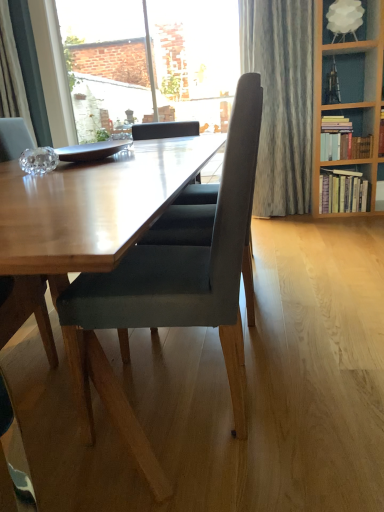
Question: In the image, is wooden table at center on the left side or the right side of hardcover books at right, which appears as the 2th book when viewed from the top?

Choices:
 (A) right
 (B) left

Answer: (B)

Question: In terms of height, does wooden table at center look taller or shorter compared to hardcover books at right, which appears as the 2th book when viewed from the top?

Choices:
 (A) short
 (B) tall

Answer: (A)

Question: Considering the real-world distances, which object is farthest from the transparent glass window at upper center?

Choices:
 (A) hardcover books at right, which is counted as the first book, starting from the bottom
 (B) white fabric lampshade at upper right
 (C) hardcover books at upper right, which is counted as the first book, starting from the top
 (D) velvet grey chair at center
 (E) wooden table at center

Answer: (D)

Question: Estimate the real-world distances between objects in this image. Which object is farther from the wooden table at center?

Choices:
 (A) white fabric lampshade at upper right
 (B) transparent glass window at upper center
 (C) hardcover books at right, which is counted as the first book, starting from the bottom
 (D) hardcover books at upper right, which is counted as the first book, starting from the top
 (E) velvet grey chair at center

Answer: (B)